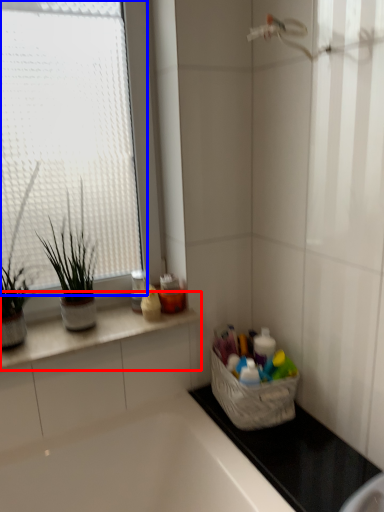
Question: Which object appears farthest to the camera in this image, countertop (highlighted by a red box) or window (highlighted by a blue box)?

Choices:
 (A) countertop
 (B) window

Answer: (A)